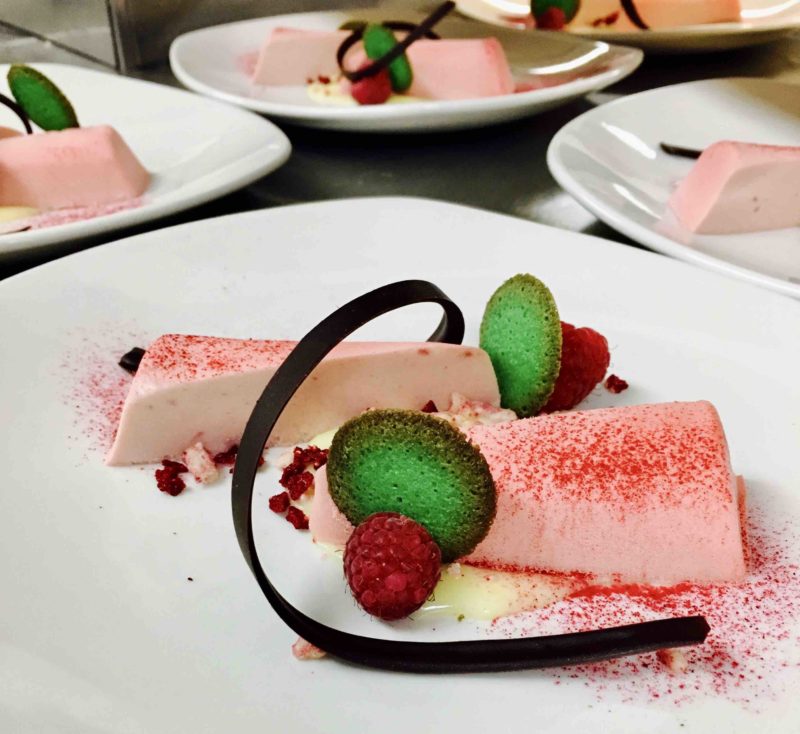
You are a GUI agent. You are given a task and a screenshot of the screen. Output one action in this format:
    pyautogui.click(x=<x>, y=<y>)
    Task: Click on the plate
    This screenshot has width=800, height=734.
    Given the screenshot: What is the action you would take?
    (202, 247)